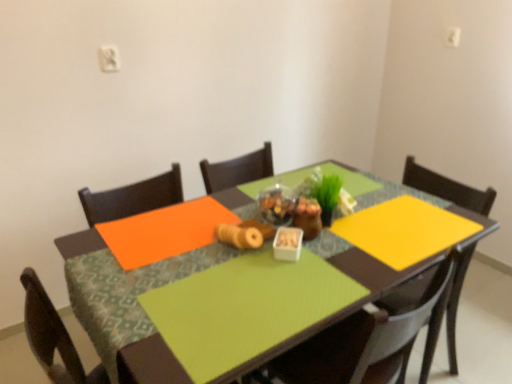
At what (x,y) coordinates should I click in order to perform the action: click on free space in front of green matte plant at center. Please return your answer as a coordinate pair (x, y). Looking at the image, I should click on (347, 251).